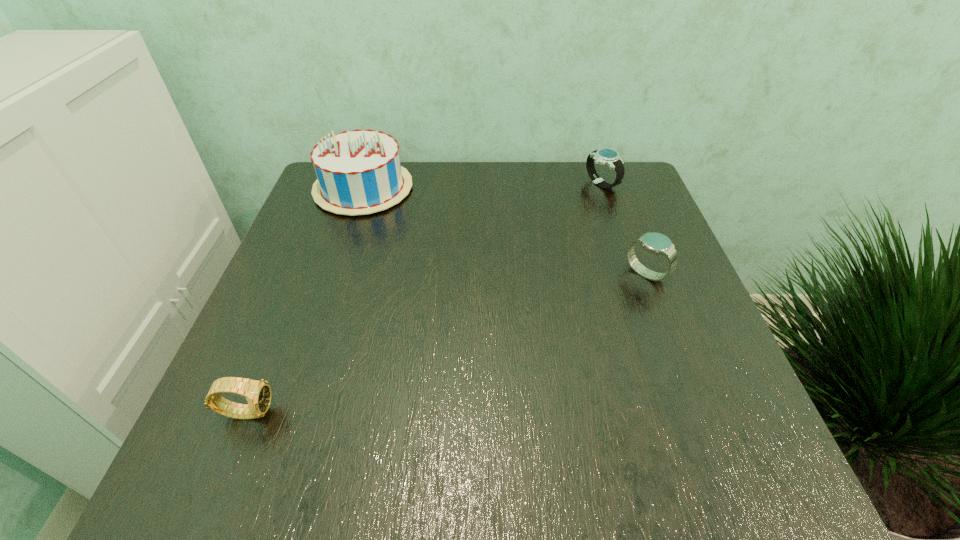
Find the location of `the third closest object to the birthday cake`. the third closest object to the birthday cake is located at coordinates (656, 243).

Find the location of `object that stands as the third closest to the birthday cake`. object that stands as the third closest to the birthday cake is located at coordinates (656, 243).

Identify which watch is the second closest to the second farthest watch. Please provide its 2D coordinates. Your answer should be formatted as a tuple, i.e. [(x, y)], where the tuple contains the x and y coordinates of a point satisfying the conditions above.

[(258, 394)]

Identify the location of watch that is the second closest to the tallest object. The image size is (960, 540). tap(258, 394).

The image size is (960, 540). What are the coordinates of `free space that satisfies the following two spatial constraints: 1. on the front side of the second nearest object; 2. on the face of the leftmost watch` in the screenshot? It's located at (698, 411).

Find the location of a particular element. This screenshot has height=540, width=960. free space that satisfies the following two spatial constraints: 1. on the front side of the second nearest object; 2. on the right side of the birthday cake is located at coordinates (335, 274).

This screenshot has width=960, height=540. I want to click on vacant region that satisfies the following two spatial constraints: 1. on the front side of the farthest watch; 2. on the left side of the third farthest object, so click(x=633, y=274).

In order to click on free space that satisfies the following two spatial constraints: 1. on the back side of the farthest watch; 2. on the right side of the tallest object in this screenshot , I will do `click(365, 184)`.